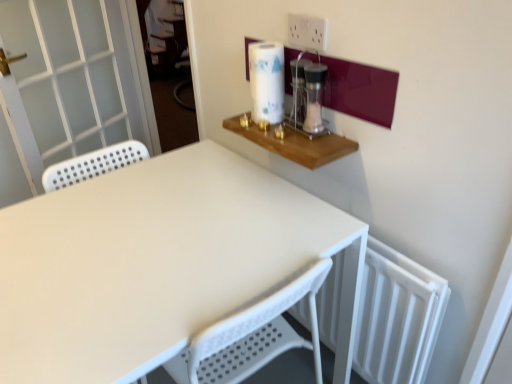
The height and width of the screenshot is (384, 512). Identify the location of free space in front of white glossy paper towel at upper right. (285, 136).